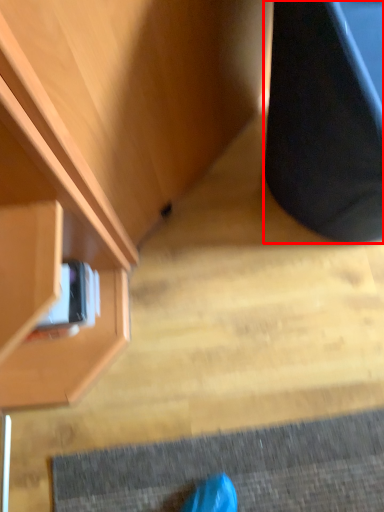
Question: From the image, what is the correct spatial relationship of furniture (annotated by the red box) in relation to cabinetry?

Choices:
 (A) right
 (B) left

Answer: (A)